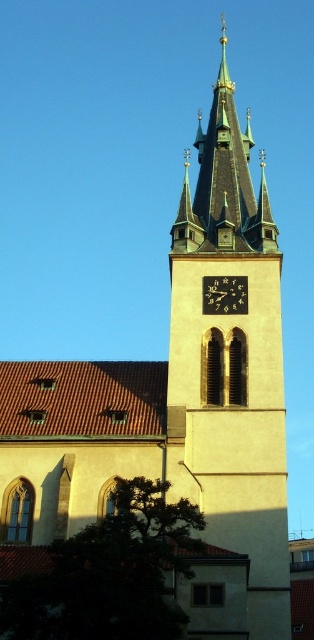
Question: Is greenish-golden spire at center thinner than black metallic clock at center?

Choices:
 (A) yes
 (B) no

Answer: (B)

Question: Does green stone clock tower at center appear on the right side of greenish-golden spire at center?

Choices:
 (A) no
 (B) yes

Answer: (B)

Question: Observing the image, what is the correct spatial positioning of greenish-golden spire at center in reference to black metallic clock at center?

Choices:
 (A) left
 (B) right

Answer: (B)

Question: Which object is farther from the camera taking this photo?

Choices:
 (A) black metallic clock at center
 (B) greenish-golden spire at center
 (C) green stone clock tower at center

Answer: (B)

Question: Among these points, which one is nearest to the camera?

Choices:
 (A) (231, 227)
 (B) (236, 308)
 (C) (211, 186)

Answer: (B)

Question: Among these points, which one is farthest from the camera?

Choices:
 (A) (178, 211)
 (B) (236, 246)
 (C) (245, 284)

Answer: (A)